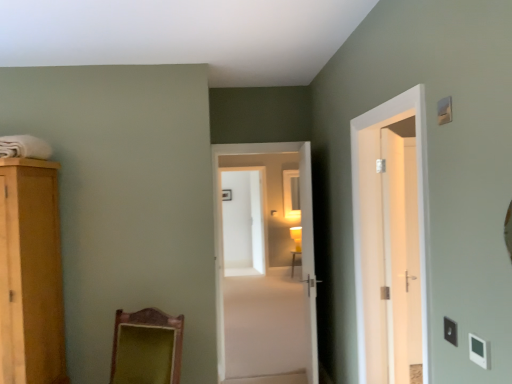
Identify the location of free point above white glossy door at center, the second door positioned from the back (from a real-world perspective). The image size is (512, 384). click(x=262, y=140).